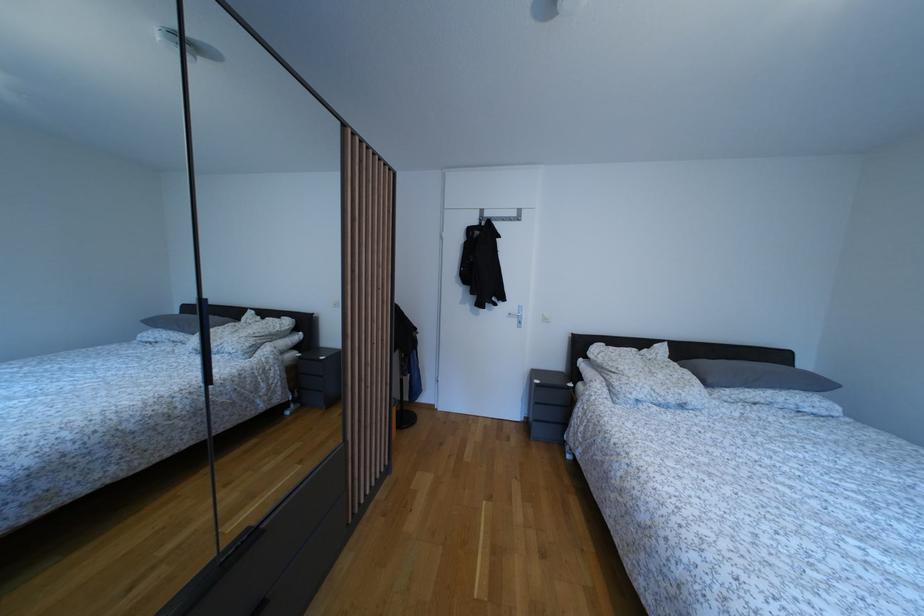
This screenshot has width=924, height=616. Find the location of `metal door handle`. metal door handle is located at coordinates (517, 312).